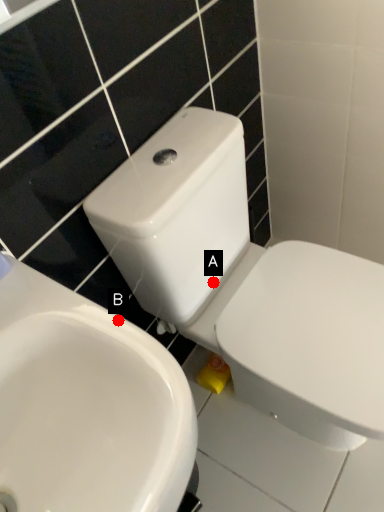
Question: Two points are circled on the image, labeled by A and B beside each circle. Which point is closer to the camera?

Choices:
 (A) A is closer
 (B) B is closer

Answer: (B)